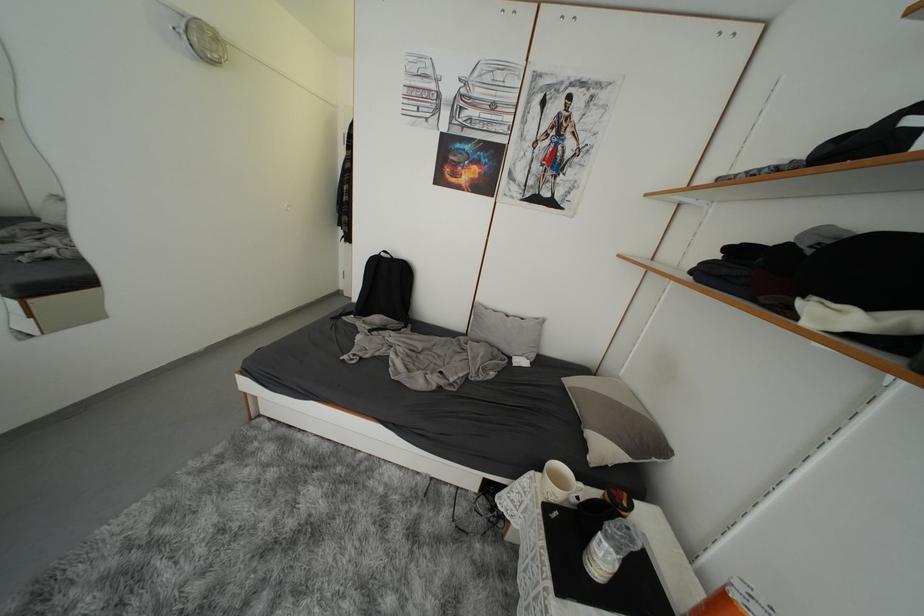
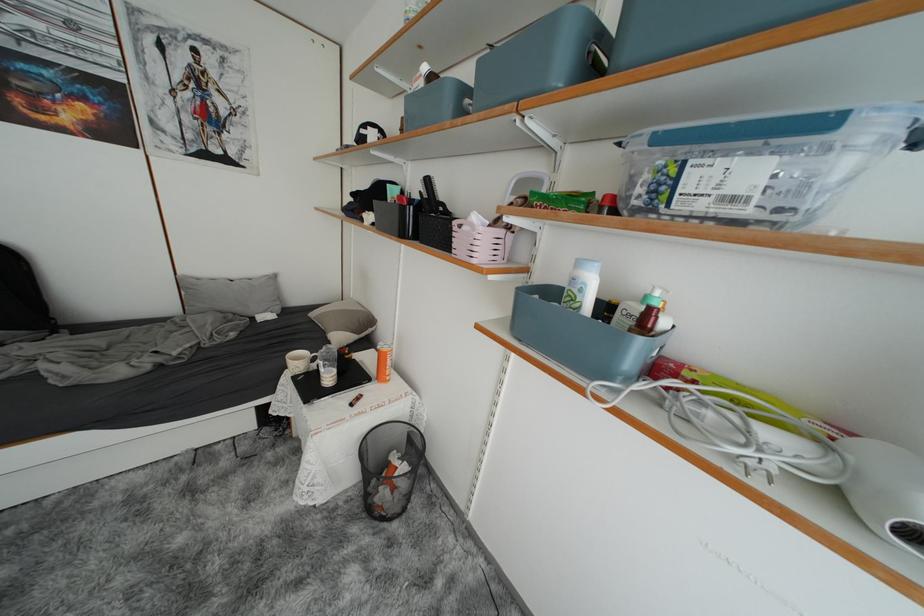
In the second image, find the point that corresponds to [516,315] in the first image.

(238, 281)